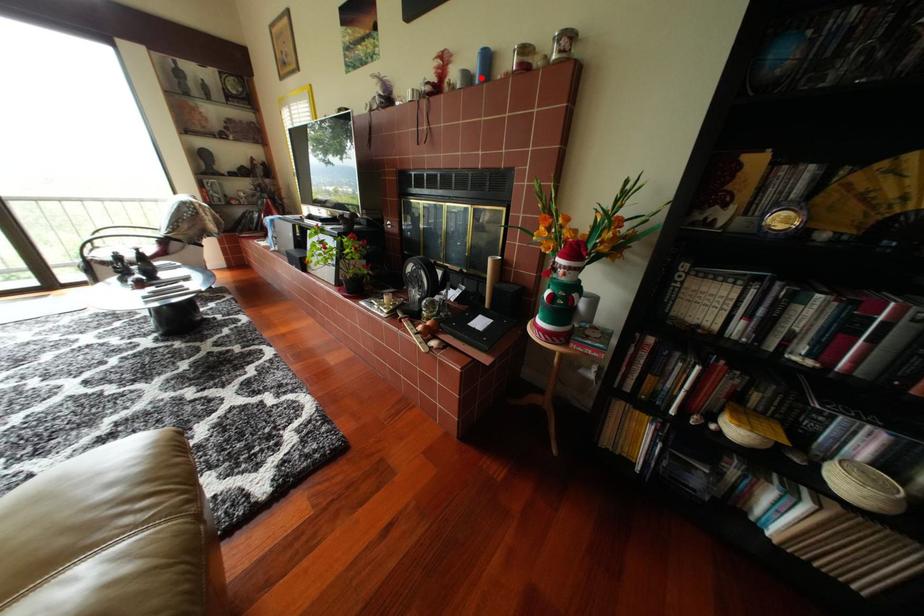
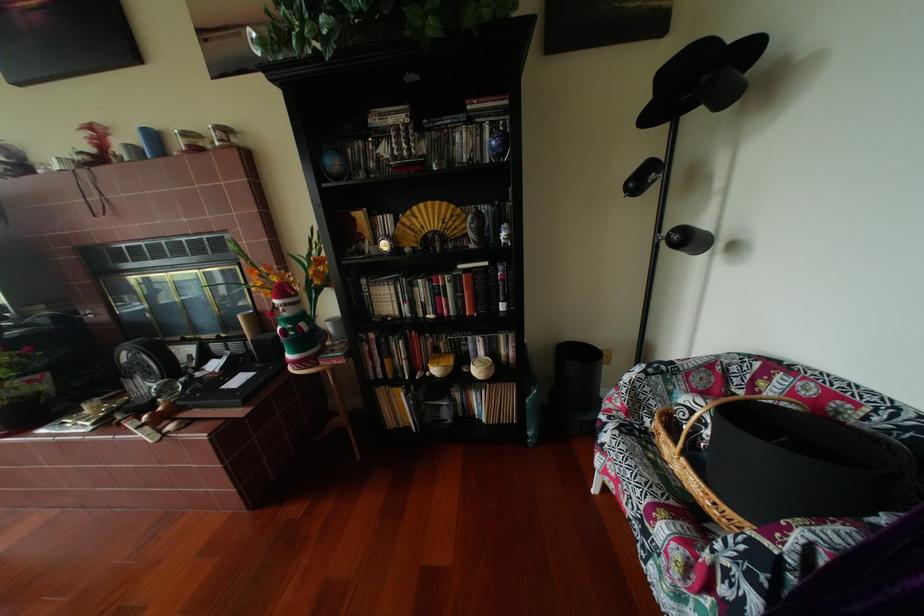
Question: A red point is marked in image1. In image2, is the corresponding 3D point closer to the camera or farther? Reply with the corresponding letter.

Choices:
 (A) The corresponding 3D point is closer.
 (B) The corresponding 3D point is farther.

Answer: (B)